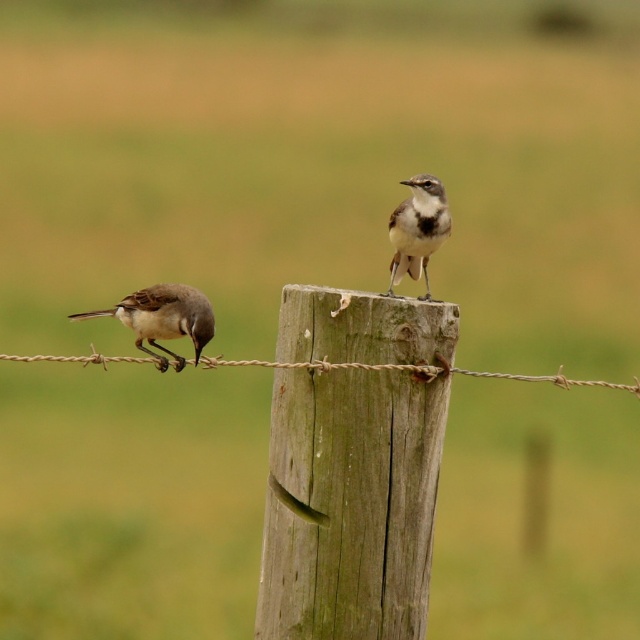
You are a drone operator trying to capture a closeup of the two birds on the wooden post. The first bird is at point (412, 460) and the second bird is at point (125, 356). Which bird should you focus on first to ensure the best shot without moving the drone?

The first bird at point (412, 460) is in front of the second bird at point (125, 356), so focusing on the first bird will ensure it is in the foreground and the best shot without moving the drone.

You are a birdwatcher observing the scene. You notice the brown speckled feathers at left and the gray speckled bird at upper center. Which bird is positioned higher in the image?

The gray speckled bird at upper center is positioned higher in the image than the brown speckled feathers at left.

You are a birdhouse builder observing the scene. You need to determine if the weathered wood post at center can support a new birdhouse that requires a base width of 30 cm. The gray speckled bird at upper center is currently perched there. Can the post accommodate the birdhouse without displacing the bird?

The weathered wood post at center might be wider than the gray speckled bird at upper center. Since the bird is perched there, the post must be at least as wide as the bird to support it. If the post is wider than the bird, it likely has enough width to also accommodate a 30 cm base birdhouse, provided other structural factors are considered.